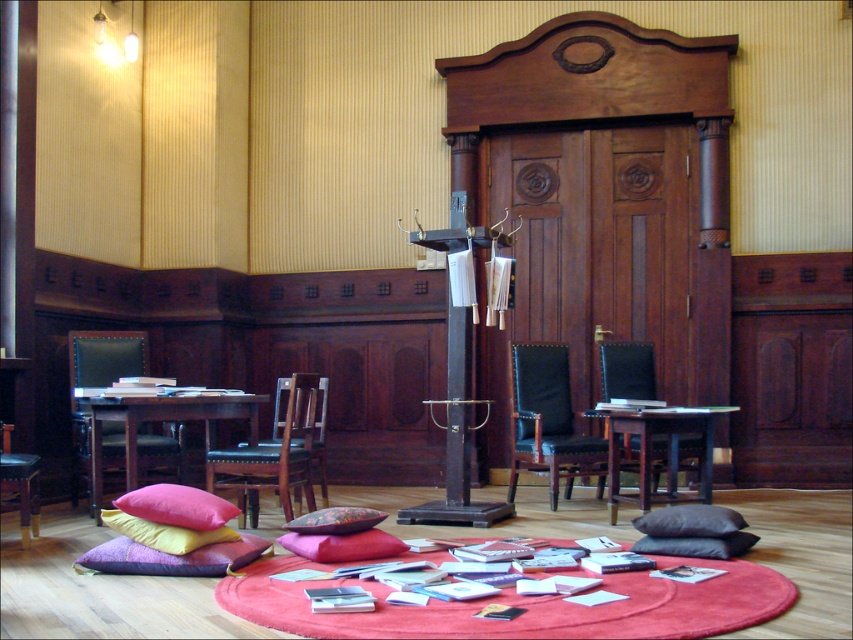
Question: Which is nearer to the velvet cushion at center?

Choices:
 (A) leather cushioned chair at center
 (B) wooden stool at lower left
 (C) velvet pink pillow at lower left

Answer: (C)

Question: Which of the following is the closest to the observer?

Choices:
 (A) black leather armchair at right
 (B) black leather armchair at center
 (C) leather cushioned chair at center

Answer: (C)

Question: Considering the relative positions of velvet cushion at center and dark brown cushion at center in the image provided, where is velvet cushion at center located with respect to dark brown cushion at center?

Choices:
 (A) left
 (B) right

Answer: (A)

Question: Which object appears farthest from the camera in this image?

Choices:
 (A) yellow fabric pillow at lower left
 (B) velvet purple pillow at lower left

Answer: (A)

Question: Considering the relative positions of velvet purple pillow at lower left and black matte pillow at lower center in the image provided, where is velvet purple pillow at lower left located with respect to black matte pillow at lower center?

Choices:
 (A) above
 (B) below

Answer: (B)

Question: Does soft red carpet at center appear under floral fabric cushion at center?

Choices:
 (A) no
 (B) yes

Answer: (B)